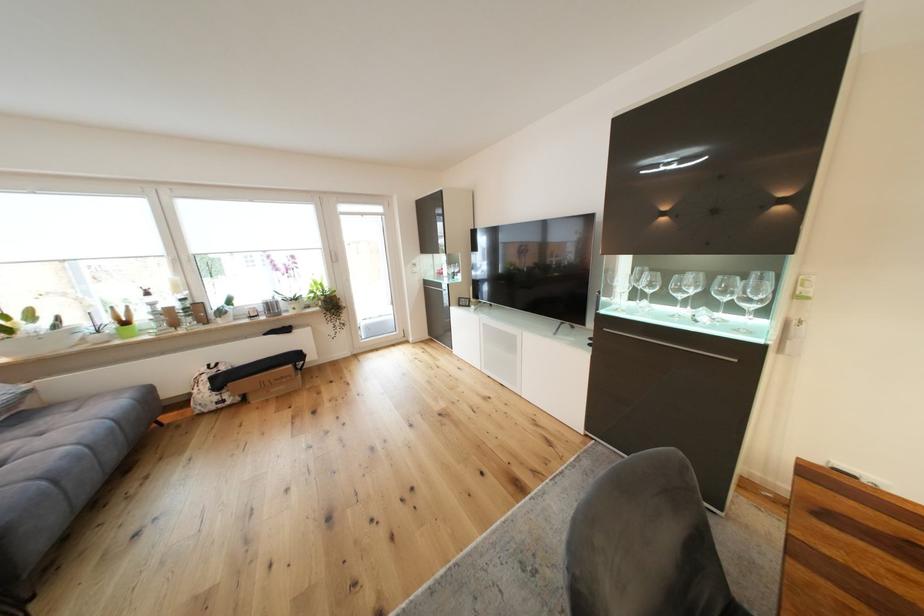
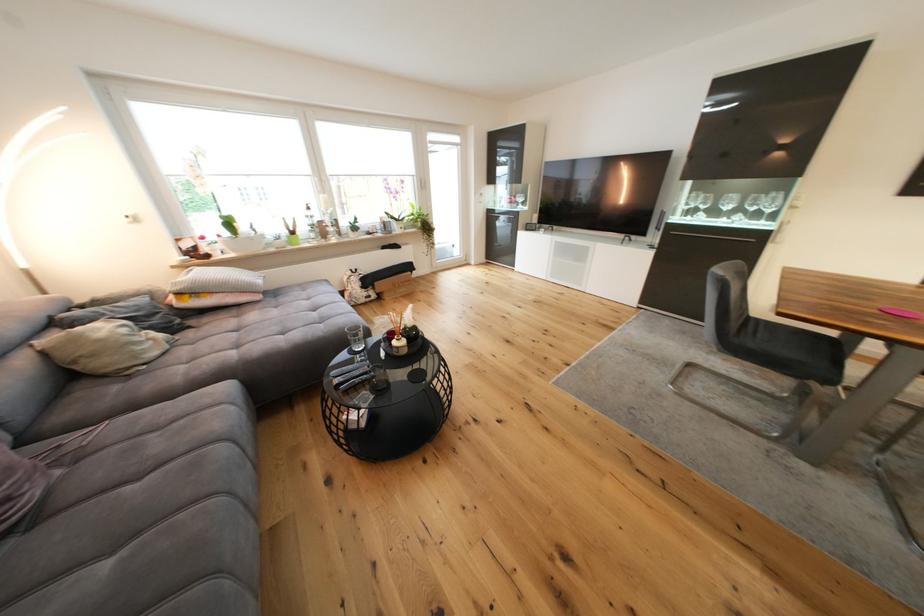
Find the pixel in the second image that matches pixel 710 302 in the first image.

(746, 212)